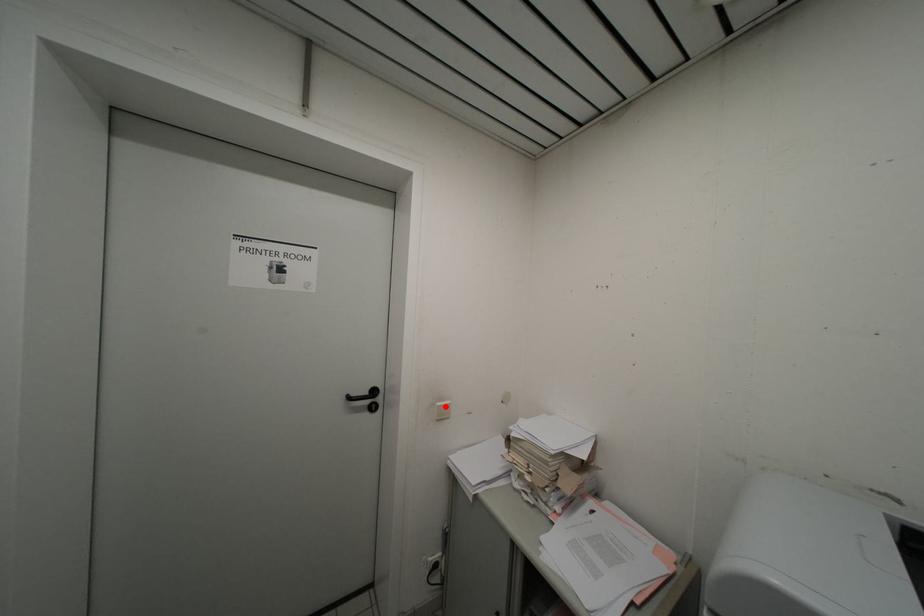
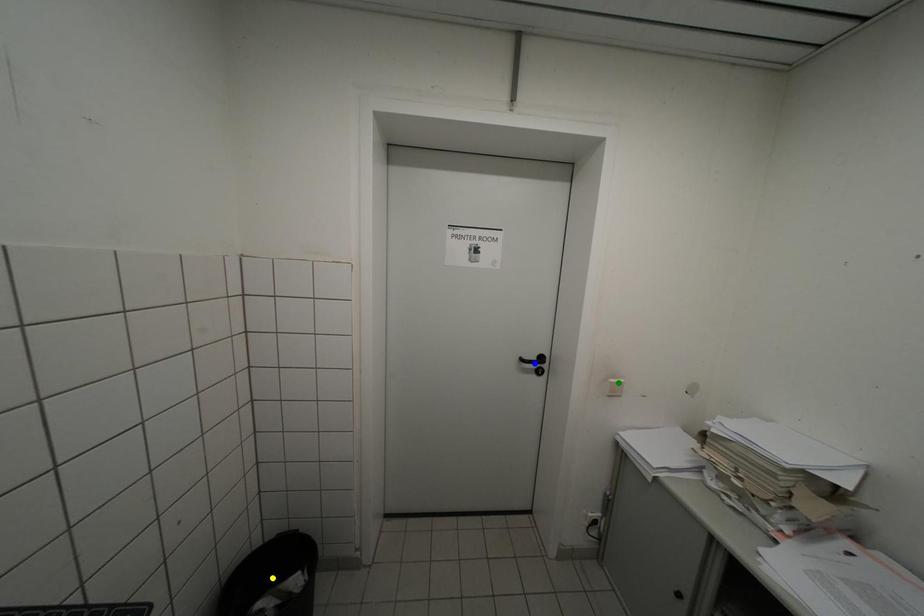
Question: I am providing you with two images of the same scene from different viewpoints. A red point is marked on the first image. You are given multiple points on the second image. Can you choose the point in image 2 that corresponds to the point in image 1?

Choices:
 (A) blue point
 (B) green point
 (C) yellow point

Answer: (B)